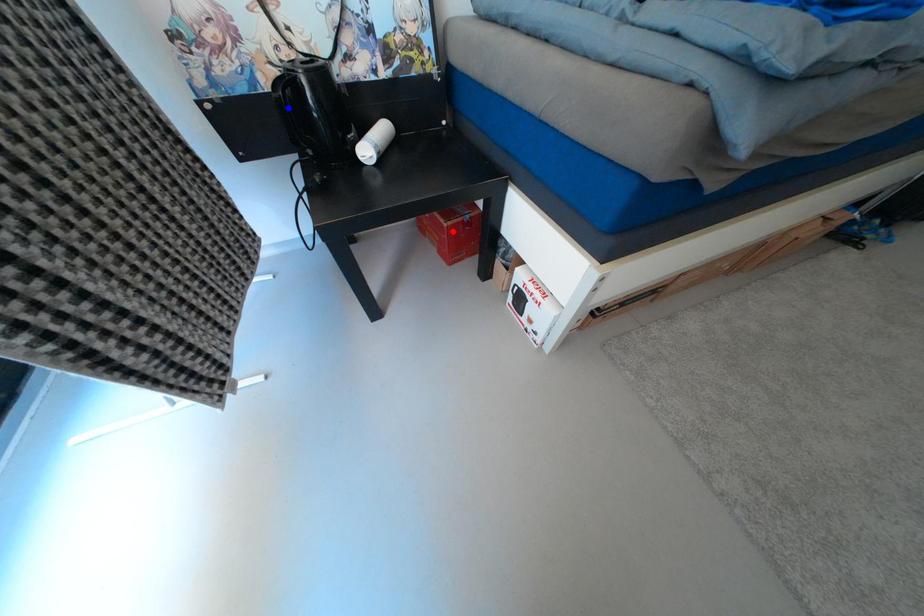
Question: Two points are marked on the image. Which point is closer to the camera?

Choices:
 (A) Blue point is closer.
 (B) Red point is closer.

Answer: (A)